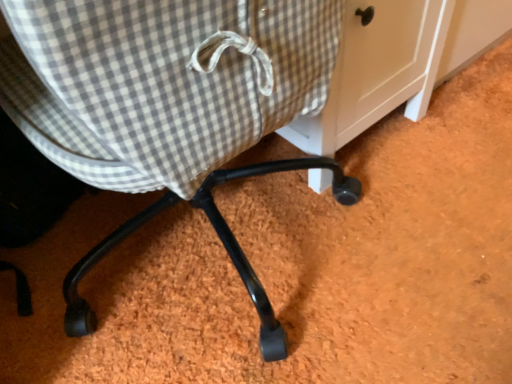
This screenshot has width=512, height=384. What do you see at coordinates (167, 104) in the screenshot? I see `black plastic chair legs at lower center` at bounding box center [167, 104].

Where is `black plastic chair legs at lower center`? black plastic chair legs at lower center is located at coordinates (167, 104).

The height and width of the screenshot is (384, 512). Identify the location of black plastic chair legs at lower center. (167, 104).